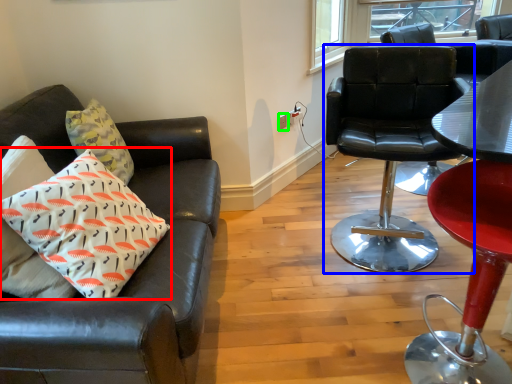
Question: Considering the real-world distances, which object is farthest from pillow (highlighted by a red box)? chair (highlighted by a blue box) or power outlet (highlighted by a green box)?

Choices:
 (A) chair
 (B) power outlet

Answer: (B)